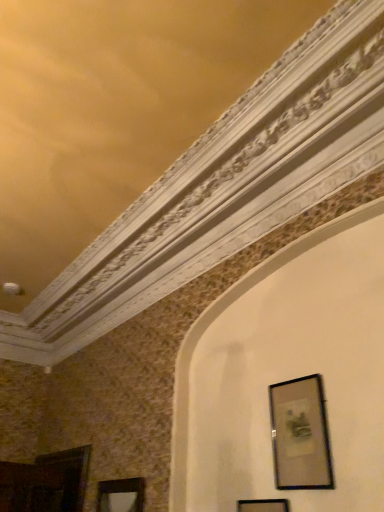
Question: Is black matte picture frame at lower right, placed as the 1th picture frame when sorted from front to back, positioned in front of matte black picture frame at lower left, the first picture frame viewed from the back?

Choices:
 (A) no
 (B) yes

Answer: (B)

Question: From the image's perspective, is black matte picture frame at lower right, placed as the 1th picture frame when sorted from front to back, beneath matte black picture frame at lower left, arranged as the third picture frame when viewed from the right?

Choices:
 (A) yes
 (B) no

Answer: (B)

Question: Does black matte picture frame at lower right, the 2th picture frame positioned from the right, have a lesser height compared to matte black picture frame at lower left, the 1th picture frame when ordered from left to right?

Choices:
 (A) no
 (B) yes

Answer: (A)

Question: Is black matte picture frame at lower right, the 2th picture frame positioned from the right, at the right side of matte black picture frame at lower left, the 1th picture frame when ordered from left to right?

Choices:
 (A) yes
 (B) no

Answer: (A)

Question: Does black matte picture frame at lower right, the 2th picture frame positioned from the right, appear on the left side of matte black picture frame at lower left, arranged as the third picture frame when viewed from the right?

Choices:
 (A) yes
 (B) no

Answer: (B)

Question: Is matte black picture frame at lower left, the first picture frame viewed from the back, completely or partially inside black matte picture frame at lower right, placed as the 1th picture frame when sorted from front to back?

Choices:
 (A) no
 (B) yes

Answer: (A)

Question: Considering the relative sizes of matte black picture frame at lower left, the first picture frame viewed from the back, and matte black picture frame at lower right, the third picture frame in the left-to-right sequence, in the image provided, is matte black picture frame at lower left, the first picture frame viewed from the back, shorter than matte black picture frame at lower right, the third picture frame in the left-to-right sequence,?

Choices:
 (A) yes
 (B) no

Answer: (A)

Question: Considering the relative sizes of matte black picture frame at lower left, the 1th picture frame when ordered from left to right, and matte black picture frame at lower right, which ranks as the second picture frame in front-to-back order, in the image provided, is matte black picture frame at lower left, the 1th picture frame when ordered from left to right, smaller than matte black picture frame at lower right, which ranks as the second picture frame in front-to-back order,?

Choices:
 (A) yes
 (B) no

Answer: (B)

Question: Is matte black picture frame at lower left, the first picture frame viewed from the back, thinner than matte black picture frame at lower right, which ranks as the second picture frame in back-to-front order?

Choices:
 (A) yes
 (B) no

Answer: (B)

Question: Is matte black picture frame at lower right, which ranks as the second picture frame in back-to-front order, a part of matte black picture frame at lower left, the first picture frame viewed from the back?

Choices:
 (A) no
 (B) yes

Answer: (A)

Question: Is matte black picture frame at lower left, the 1th picture frame when ordered from left to right, positioned in front of matte black picture frame at lower right, which appears as the first picture frame when viewed from the right?

Choices:
 (A) yes
 (B) no

Answer: (B)

Question: Can you confirm if matte black picture frame at lower left, marked as the 3th picture frame in a front-to-back arrangement, is bigger than matte black picture frame at lower right, which appears as the first picture frame when viewed from the right?

Choices:
 (A) no
 (B) yes

Answer: (B)

Question: Does black matte picture frame at lower right, placed as the 1th picture frame when sorted from front to back, have a smaller size compared to matte black picture frame at lower right, which ranks as the second picture frame in back-to-front order?

Choices:
 (A) yes
 (B) no

Answer: (B)